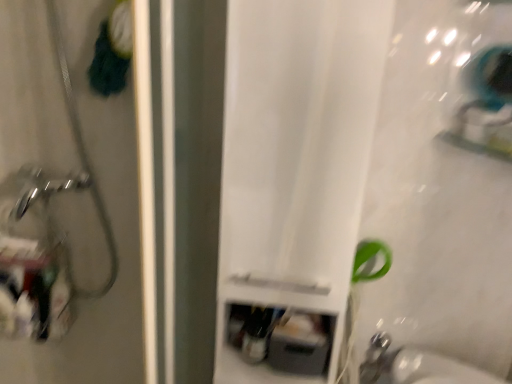
Question: Does brushed metal showerhead at left come in front of satin nickel faucet at lower right?

Choices:
 (A) yes
 (B) no

Answer: (A)

Question: Can you confirm if brushed metal showerhead at left is wider than satin nickel faucet at lower right?

Choices:
 (A) yes
 (B) no

Answer: (A)

Question: Considering the relative sizes of brushed metal showerhead at left and satin nickel faucet at lower right in the image provided, is brushed metal showerhead at left shorter than satin nickel faucet at lower right?

Choices:
 (A) yes
 (B) no

Answer: (B)

Question: Is brushed metal showerhead at left bigger than satin nickel faucet at lower right?

Choices:
 (A) no
 (B) yes

Answer: (B)

Question: From the image's perspective, is brushed metal showerhead at left below satin nickel faucet at lower right?

Choices:
 (A) no
 (B) yes

Answer: (A)

Question: Looking at the image, does white matte curtain at center seem bigger or smaller compared to satin nickel faucet at lower right?

Choices:
 (A) small
 (B) big

Answer: (B)

Question: Visually, is white matte curtain at center positioned to the left or to the right of satin nickel faucet at lower right?

Choices:
 (A) left
 (B) right

Answer: (A)

Question: Looking at their shapes, would you say white matte curtain at center is wider or thinner than satin nickel faucet at lower right?

Choices:
 (A) thin
 (B) wide

Answer: (B)

Question: From a real-world perspective, is white matte curtain at center above or below satin nickel faucet at lower right?

Choices:
 (A) below
 (B) above

Answer: (B)

Question: From the image's perspective, is white matte curtain at center above or below brushed metal showerhead at left?

Choices:
 (A) above
 (B) below

Answer: (B)

Question: Looking at their shapes, would you say white matte curtain at center is wider or thinner than brushed metal showerhead at left?

Choices:
 (A) thin
 (B) wide

Answer: (B)

Question: Does point (229, 125) appear closer or farther from the camera than point (7, 357)?

Choices:
 (A) farther
 (B) closer

Answer: (B)

Question: Based on their positions, is white matte curtain at center located to the left or right of brushed metal showerhead at left?

Choices:
 (A) right
 (B) left

Answer: (A)

Question: Considering the positions of satin nickel faucet at lower right and brushed metal showerhead at left in the image, is satin nickel faucet at lower right taller or shorter than brushed metal showerhead at left?

Choices:
 (A) short
 (B) tall

Answer: (A)

Question: Relative to brushed metal showerhead at left, is satin nickel faucet at lower right in front or behind?

Choices:
 (A) behind
 (B) front

Answer: (A)